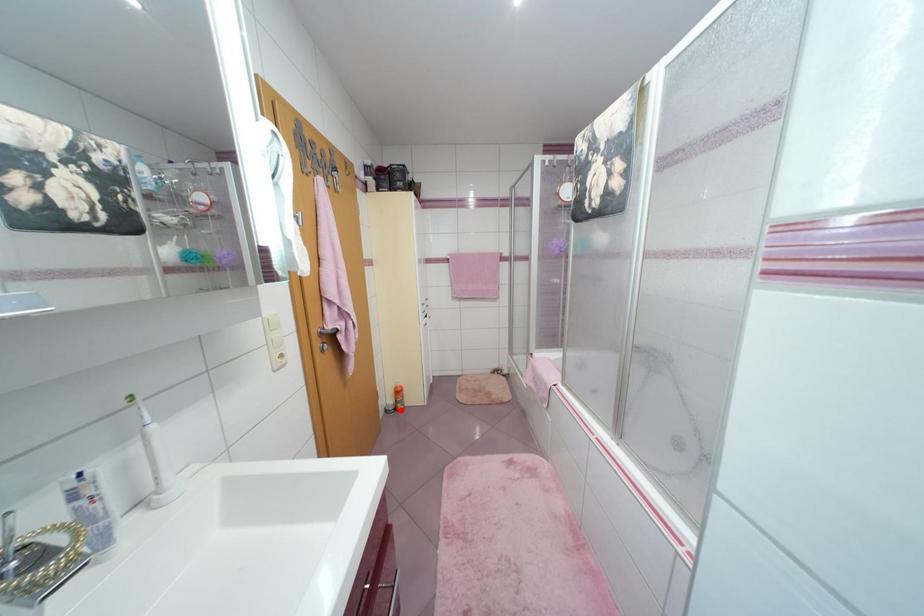
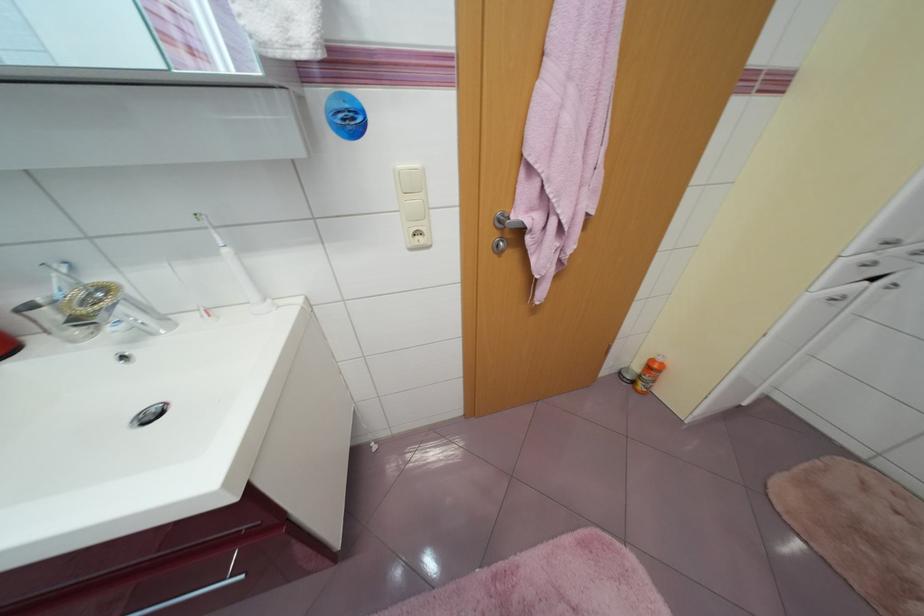
Find the pixel in the second image that matches the highlighted location in the first image.

(638, 383)